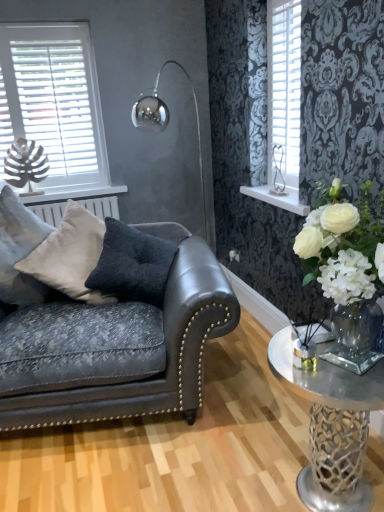
Question: Considering the relative positions of clear glass vase at right and white wood shelf at upper right in the image provided, is clear glass vase at right to the left of white wood shelf at upper right from the viewer's perspective?

Choices:
 (A) no
 (B) yes

Answer: (A)

Question: Is clear glass vase at right next to white wood shelf at upper right and touching it?

Choices:
 (A) yes
 (B) no

Answer: (B)

Question: Can you confirm if clear glass vase at right is taller than white wood shelf at upper right?

Choices:
 (A) yes
 (B) no

Answer: (A)

Question: Does clear glass vase at right have a lesser width compared to white wood shelf at upper right?

Choices:
 (A) no
 (B) yes

Answer: (A)

Question: From the image's perspective, is clear glass vase at right located above white wood shelf at upper right?

Choices:
 (A) yes
 (B) no

Answer: (B)

Question: Is clear glass vase at right not within white wood shelf at upper right?

Choices:
 (A) no
 (B) yes

Answer: (B)

Question: Could you tell me if silver metallic heart-shaped ornament at upper right is facing white silk flower at center?

Choices:
 (A) yes
 (B) no

Answer: (B)

Question: From a real-world perspective, is silver metallic heart-shaped ornament at upper right positioned under white silk flower at center based on gravity?

Choices:
 (A) yes
 (B) no

Answer: (B)

Question: Is silver metallic heart-shaped ornament at upper right shorter than white silk flower at center?

Choices:
 (A) yes
 (B) no

Answer: (B)

Question: From a real-world perspective, is silver metallic heart-shaped ornament at upper right physically above white silk flower at center?

Choices:
 (A) yes
 (B) no

Answer: (A)

Question: Can you confirm if silver metallic heart-shaped ornament at upper right is bigger than white silk flower at center?

Choices:
 (A) yes
 (B) no

Answer: (A)

Question: Considering the relative sizes of silver metallic heart-shaped ornament at upper right and white silk flower at center in the image provided, is silver metallic heart-shaped ornament at upper right smaller than white silk flower at center?

Choices:
 (A) no
 (B) yes

Answer: (A)

Question: Does leather couch at left have a lesser height compared to clear glass vase at right?

Choices:
 (A) yes
 (B) no

Answer: (B)